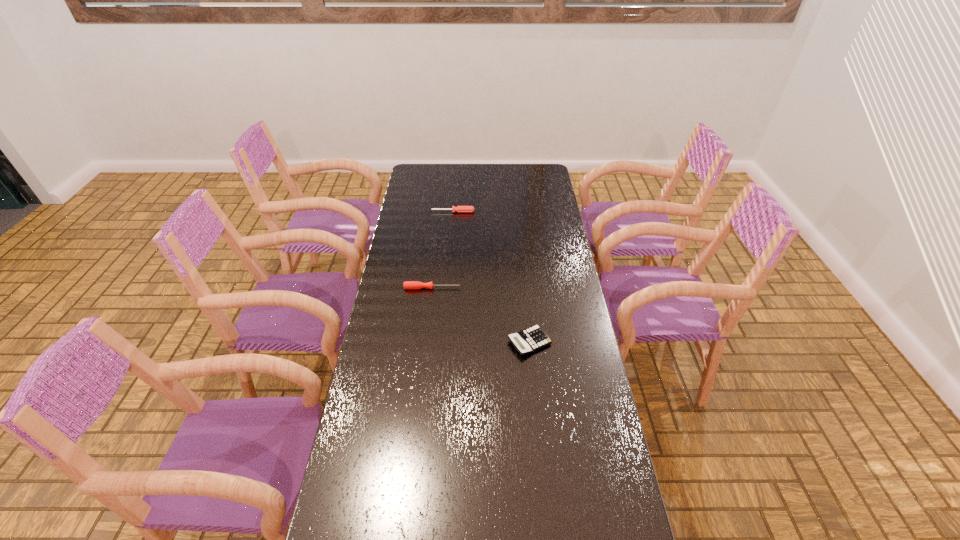
Identify the location of vacant space that is in between the nearest object and the farther screwdriver. (492, 277).

Find the location of a particular element. vacant area that lies between the rightmost object and the farther screwdriver is located at coordinates (492, 277).

You are a GUI agent. You are given a task and a screenshot of the screen. Output one action in this format:
    pyautogui.click(x=<x>, y=<y>)
    Task: Click on the vacant space that's between the rightmost object and the nearer screwdriver
    The width and height of the screenshot is (960, 540).
    Given the screenshot: What is the action you would take?
    click(x=481, y=315)

Identify the location of object that is the second nearest to the nearest object. (459, 208).

This screenshot has height=540, width=960. What are the coordinates of `object that stands as the second closest to the rightmost object` in the screenshot? It's located at (459, 208).

This screenshot has width=960, height=540. In order to click on free space that satisfies the following two spatial constraints: 1. on the front side of the farther screwdriver; 2. at the tip of the second nearest object in this screenshot , I will do `click(447, 288)`.

Find the location of a particular element. This screenshot has width=960, height=540. free space that satisfies the following two spatial constraints: 1. at the tip of the nearer screwdriver; 2. on the right side of the calculator is located at coordinates (426, 342).

The height and width of the screenshot is (540, 960). What are the coordinates of `vacant position in the image that satisfies the following two spatial constraints: 1. at the tip of the second farthest object; 2. on the back side of the nearest object` in the screenshot? It's located at (426, 342).

The width and height of the screenshot is (960, 540). Find the location of `free space that satisfies the following two spatial constraints: 1. on the back side of the calculator; 2. at the tip of the second farthest object`. free space that satisfies the following two spatial constraints: 1. on the back side of the calculator; 2. at the tip of the second farthest object is located at coordinates click(x=524, y=288).

Locate an element on the screen. The image size is (960, 540). free location that satisfies the following two spatial constraints: 1. at the tip of the calculator; 2. on the right side of the nearer screwdriver is located at coordinates (426, 342).